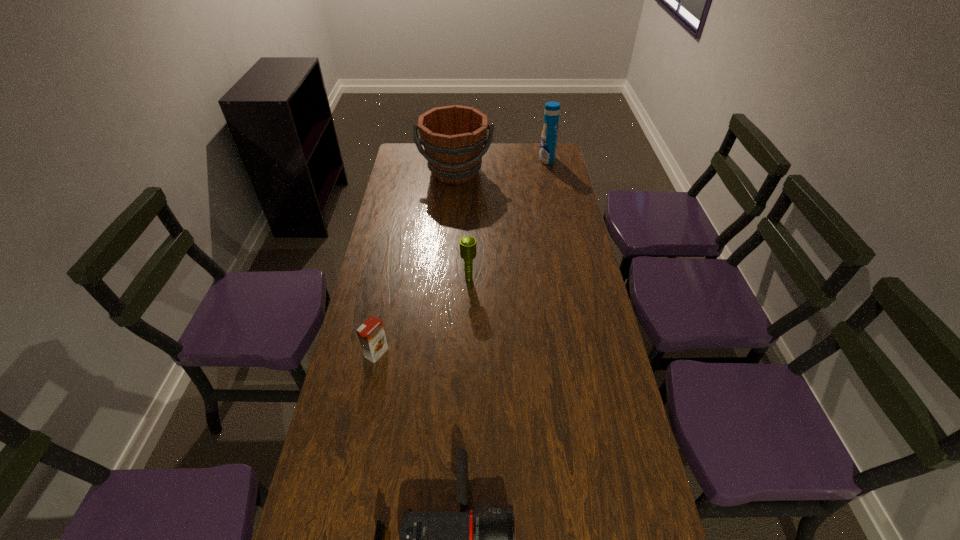
Where is `the rightmost object`? the rightmost object is located at coordinates (548, 143).

Find the location of a particular element. bucket is located at coordinates (453, 137).

Identify the location of the third tallest object. This screenshot has width=960, height=540. (467, 243).

I want to click on the third farthest object, so click(467, 243).

The width and height of the screenshot is (960, 540). I want to click on the fourth farthest object, so click(x=371, y=334).

Where is `vacant space situated 0.150m on the front-facing side of the rightmost object`? The image size is (960, 540). vacant space situated 0.150m on the front-facing side of the rightmost object is located at coordinates (508, 159).

At what (x,y) coordinates should I click in order to perform the action: click on vacant space located on the front-facing side of the rightmost object. Please return your answer as a coordinate pair (x, y). Image resolution: width=960 pixels, height=540 pixels. Looking at the image, I should click on (499, 159).

Locate an element on the screen. This screenshot has width=960, height=540. vacant point located 0.340m on the front-facing side of the rightmost object is located at coordinates (468, 159).

Find the location of a particular element. The image size is (960, 540). free space located on the handle side of the bucket is located at coordinates (452, 213).

This screenshot has height=540, width=960. I want to click on vacant area located 0.080m on the back of the third nearest object, so click(469, 258).